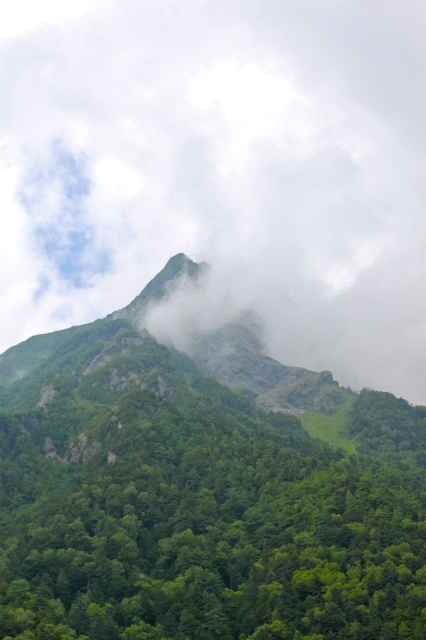
Question: Which object is farther from the camera taking this photo?

Choices:
 (A) green leafy tree at center
 (B) white fluffy cloud at upper center

Answer: (B)

Question: Which point is closer to the camera?

Choices:
 (A) white fluffy cloud at upper center
 (B) green leafy tree at center

Answer: (B)

Question: Can you confirm if white fluffy cloud at upper center is thinner than green leafy tree at center?

Choices:
 (A) no
 (B) yes

Answer: (A)

Question: Is white fluffy cloud at upper center positioned in front of green leafy tree at center?

Choices:
 (A) no
 (B) yes

Answer: (A)

Question: Does white fluffy cloud at upper center have a larger size compared to green leafy tree at center?

Choices:
 (A) yes
 (B) no

Answer: (A)